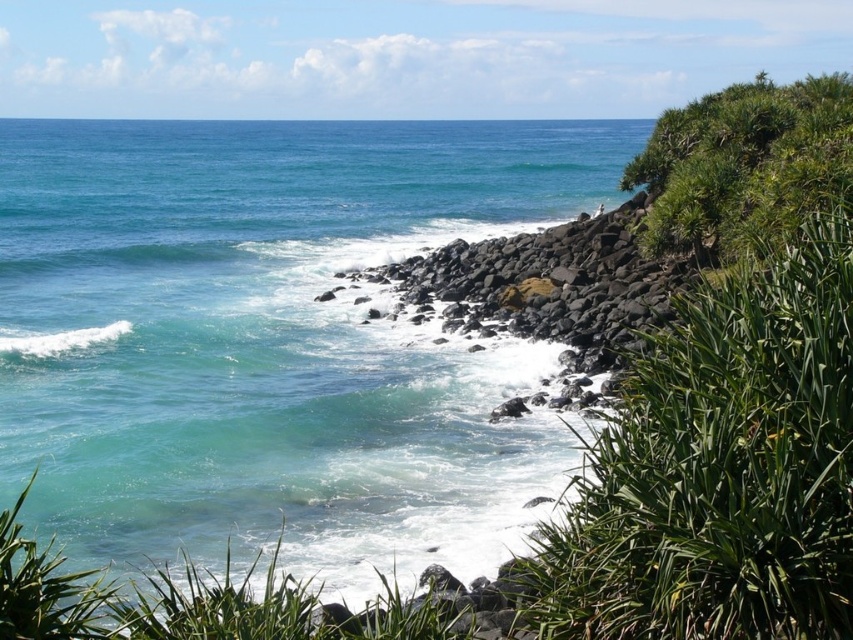
Question: Is teal water at center smaller than green leafy plant at right?

Choices:
 (A) yes
 (B) no

Answer: (B)

Question: Is teal water at center to the right of green leafy plant at right from the viewer's perspective?

Choices:
 (A) yes
 (B) no

Answer: (B)

Question: From the image, what is the correct spatial relationship of teal water at center in relation to green leafy shrub at upper right?

Choices:
 (A) below
 (B) above

Answer: (B)

Question: Among these objects, which one is farthest from the camera?

Choices:
 (A) green leafy plant at right
 (B) green leafy shrub at upper right

Answer: (B)

Question: Estimate the real-world distances between objects in this image. Which object is farther from the green leafy shrub at upper right?

Choices:
 (A) teal water at center
 (B) green leafy plant at right

Answer: (A)

Question: Which object is positioned closest to the teal water at center?

Choices:
 (A) green leafy shrub at upper right
 (B) green leafy plant at right

Answer: (A)